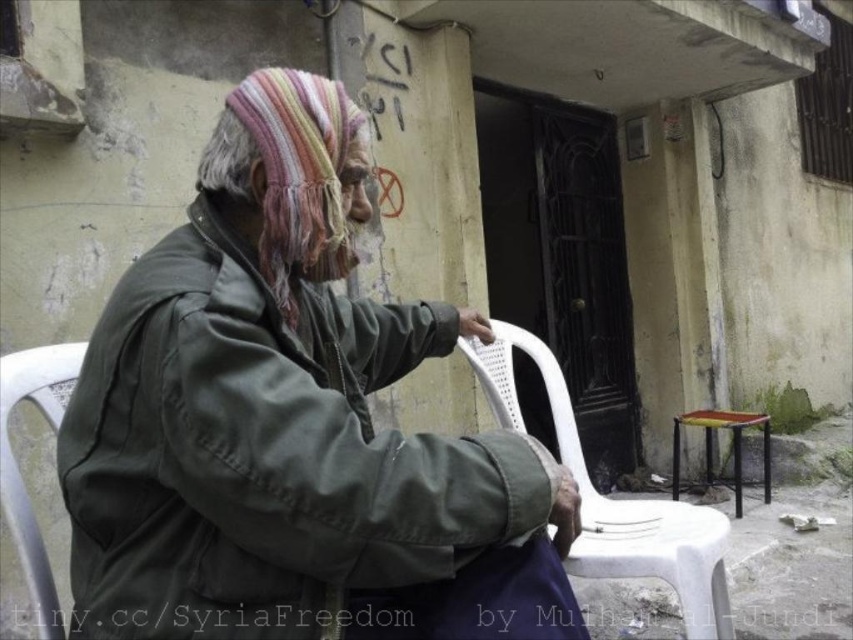
Between white plastic chair at lower right and yellow plastic stool at lower right, which one has more height?

white plastic chair at lower right is taller.

Does point (693, 556) come farther from viewer compared to point (751, 417)?

No.

What are the coordinates of `white plastic chair at lower right` in the screenshot? It's located at (614, 499).

Which is more to the left, green matte jacket at center or yellow plastic stool at lower right?

green matte jacket at center is more to the left.

Does green matte jacket at center appear over yellow plastic stool at lower right?

Correct, green matte jacket at center is located above yellow plastic stool at lower right.

Find the location of a particular element. The image size is (853, 640). green matte jacket at center is located at coordinates (289, 422).

I want to click on green matte jacket at center, so click(289, 422).

Which is more to the left, white plastic chair at lower left or yellow plastic stool at lower right?

Positioned to the left is white plastic chair at lower left.

Is point (56, 406) farther from viewer compared to point (672, 468)?

No, it is not.

Image resolution: width=853 pixels, height=640 pixels. Find the location of `white plastic chair at lower left`. white plastic chair at lower left is located at coordinates (18, 467).